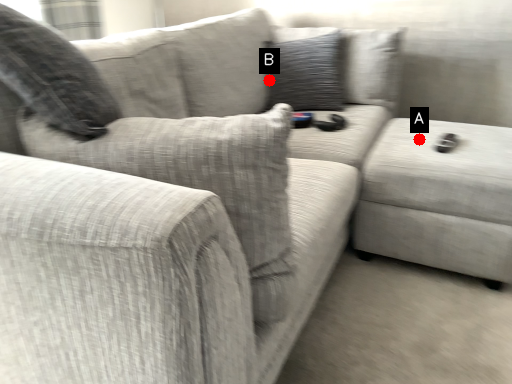
Question: Two points are circled on the image, labeled by A and B beside each circle. Which point is farther from the camera taking this photo?

Choices:
 (A) A is further
 (B) B is further

Answer: (B)